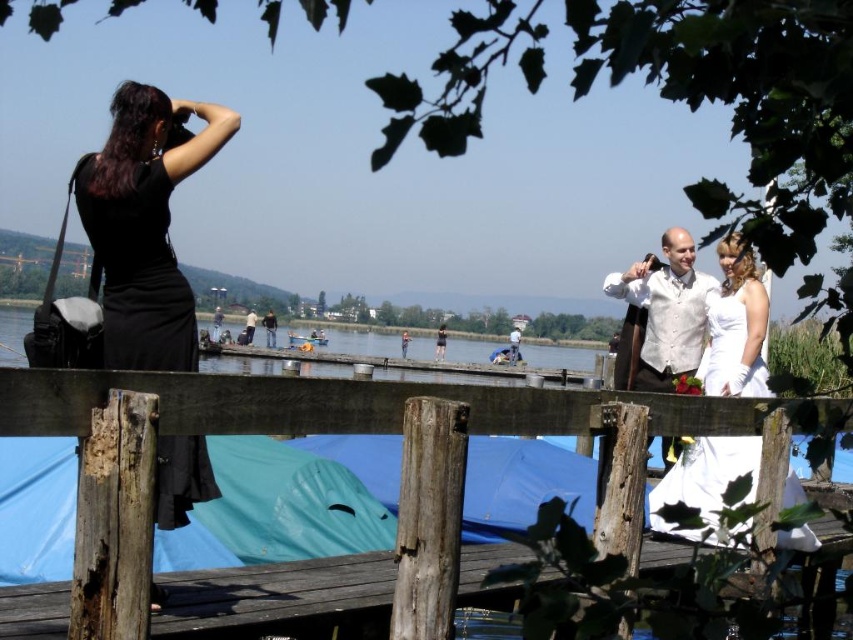
Question: Can you confirm if black satin dress at left is positioned to the right of white satin vest at center?

Choices:
 (A) yes
 (B) no

Answer: (B)

Question: Is wooden at lower center thinner than black satin dress at left?

Choices:
 (A) no
 (B) yes

Answer: (B)

Question: Which of the following is the farthest from the observer?

Choices:
 (A) (67, 428)
 (B) (86, 202)
 (C) (698, 348)

Answer: (C)

Question: Considering the real-world distances, which object is farthest from the black satin dress at left?

Choices:
 (A) clear blue water at center
 (B) wooden at lower center
 (C) white satin vest at center

Answer: (A)

Question: Is black satin dress at left wider than white satin vest at center?

Choices:
 (A) no
 (B) yes

Answer: (A)

Question: Which object appears farthest from the camera in this image?

Choices:
 (A) white satin vest at center
 (B) black satin dress at left
 (C) white satin dress at center

Answer: (C)